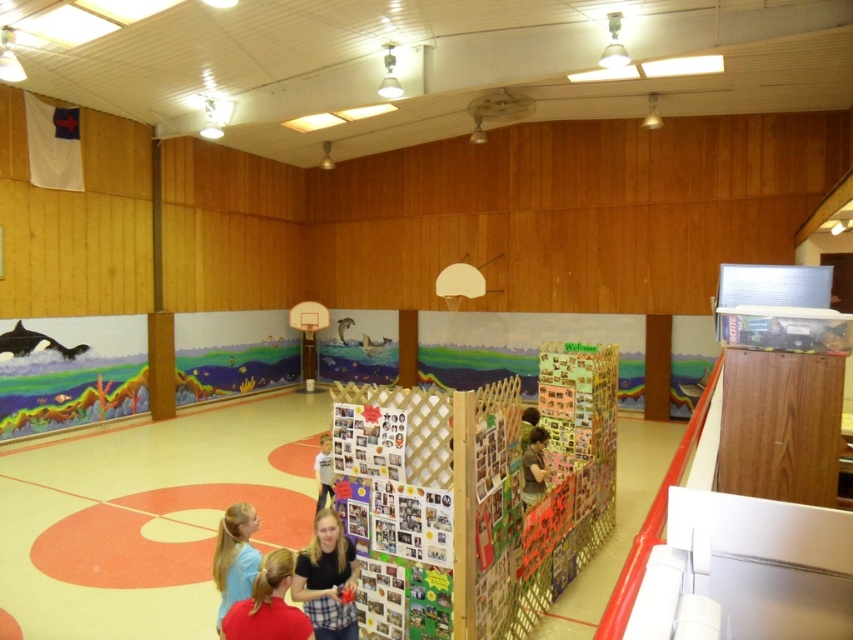
Based on the photo, you are standing at the camera position in the gymnasium. You see a person with blonde hair at lower left. If you want to approach them, how many steps would you need to take if each step covers 0.75 meters?

The distance between you and the blonde hair at lower left is 3.33 meters. Since each step covers 0.75 meters, dividing 3.33 by 0.75 gives approximately 4.44 steps. Therefore, you would need to take about 5 steps to reach them.

You are standing at the entrance of the gymnasium and see the red fabric shirt at lower center. If you walk straight ahead, will you pass by the basketball hoop or the underwater mural on the wall?

The red fabric shirt at lower center is positioned at point (x=268, y=604). Since the basketball hoop is on one wall and the underwater mural is on the left wall, walking straight ahead from the entrance would likely lead you past the basketball hoop rather than the mural, as the shirt is closer to the center and the hoop is mounted on a wall opposite the entrance.

You are a person standing at the entrance of the gymnasium and want to pick up both the plaid shirt at center and the red fabric shirt at lower center. Are they close enough to reach without moving your feet?

The plaid shirt at center and red fabric shirt at lower center are 23.08 inches apart from each other. Since the average human arm span allows reaching about 24 inches comfortably, you can likely reach both shirts without moving your feet.